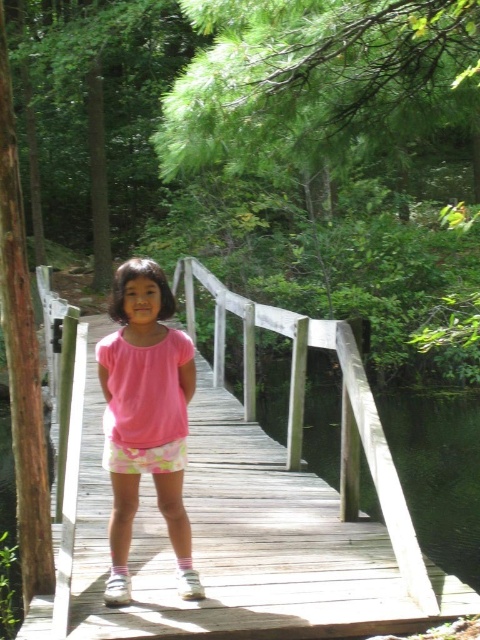
Does wooden bridge at center appear on the right side of transparent water at bridge right?

Incorrect, wooden bridge at center is not on the right side of transparent water at bridge right.

Is point (296, 472) farther from camera compared to point (326, 371)?

No, (296, 472) is closer to viewer.

Find the location of `wooden bridge at center`. wooden bridge at center is located at coordinates (240, 518).

Can you confirm if wooden bridge at center is smaller than pink cotton shirt at center?

Yes.

Does point (317, 605) come closer to viewer compared to point (116, 531)?

Yes.

Does point (430, 612) come closer to viewer compared to point (123, 445)?

Yes, it is.

The height and width of the screenshot is (640, 480). I want to click on wooden bridge at center, so click(x=240, y=518).

Does transparent water at bridge right have a larger size compared to pink cotton shirt at center?

Yes.

Who is higher up, transparent water at bridge right or pink cotton shirt at center?

pink cotton shirt at center is higher up.

Find the location of `transparent water at bridge right`. transparent water at bridge right is located at coordinates tap(439, 472).